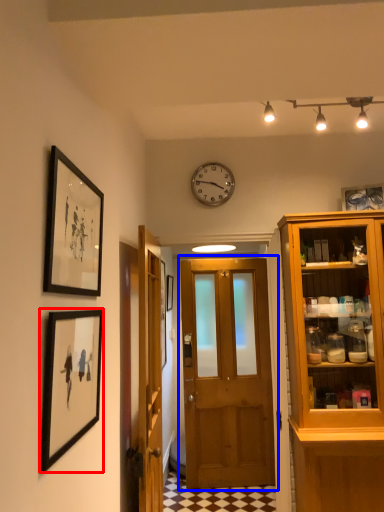
Question: Which object appears farthest to the camera in this image, picture frame (highlighted by a red box) or door (highlighted by a blue box)?

Choices:
 (A) picture frame
 (B) door

Answer: (B)